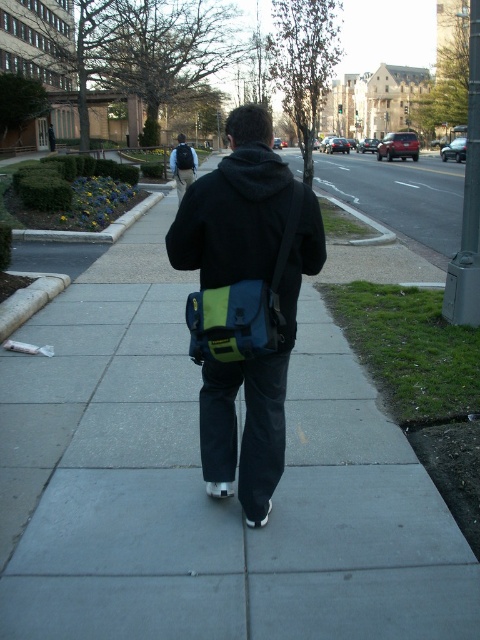
Question: Among these points, which one is farthest from the camera?

Choices:
 (A) (252, 220)
 (B) (249, 282)
 (C) (179, 144)

Answer: (C)

Question: Can you confirm if blue fabric bag at center is positioned below matte black backpack at upper center?

Choices:
 (A) yes
 (B) no

Answer: (A)

Question: Which point is closer to the camera taking this photo?

Choices:
 (A) (201, 212)
 (B) (269, 285)
 (C) (183, 152)
 (D) (180, 141)

Answer: (A)

Question: Does matte black backpack at upper center have a lesser width compared to matte blue backpack at center?

Choices:
 (A) no
 (B) yes

Answer: (A)

Question: Does matte blue-green bag at center have a larger size compared to matte blue backpack at center?

Choices:
 (A) no
 (B) yes

Answer: (A)

Question: Which of the following is the closest to the observer?

Choices:
 (A) matte blue-green bag at center
 (B) blue fabric bag at center
 (C) matte blue backpack at center
 (D) matte black backpack at upper center

Answer: (B)